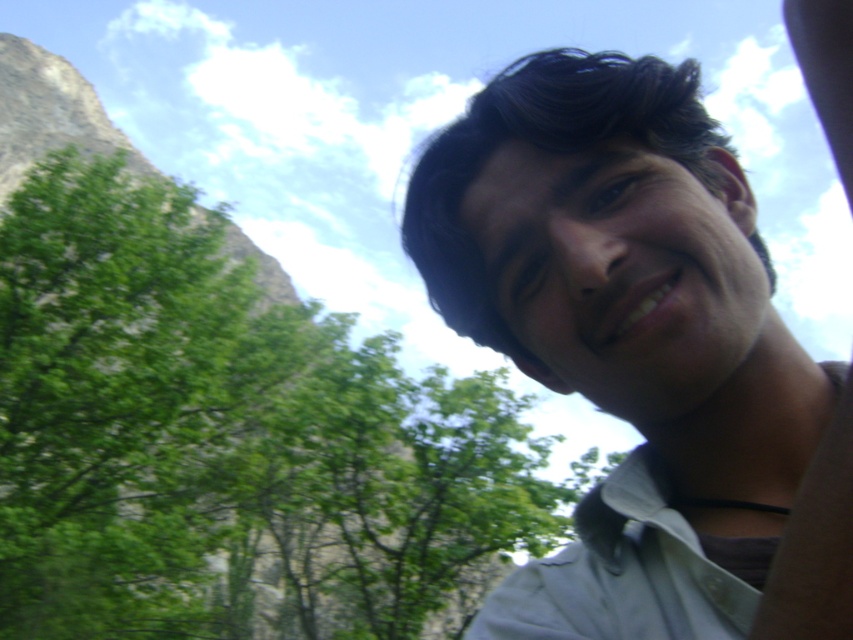
Consider the image. Does white matte shirt at upper right have a larger size compared to white cotton shirt at lower right?

Correct, white matte shirt at upper right is larger in size than white cotton shirt at lower right.

Between point (689, 252) and point (628, 612), which one is positioned in front?

Point (689, 252)

What are the coordinates of `white matte shirt at upper right` in the screenshot? It's located at (625, 332).

Between green leafy tree at upper left and white matte shirt at upper right, which one is positioned lower?

green leafy tree at upper left is lower down.

Describe the element at coordinates (227, 436) in the screenshot. I see `green leafy tree at upper left` at that location.

This screenshot has height=640, width=853. What are the coordinates of `green leafy tree at upper left` in the screenshot? It's located at click(x=227, y=436).

In the scene shown: Is green leafy tree at upper left in front of white cotton shirt at lower right?

No, green leafy tree at upper left is further to the viewer.

Is green leafy tree at upper left below white cotton shirt at lower right?

Yes, green leafy tree at upper left is below white cotton shirt at lower right.

Identify the location of green leafy tree at upper left. (227, 436).